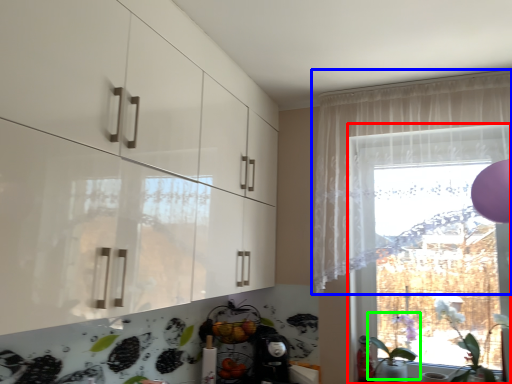
Question: Which object is the closest to the window (highlighted by a red box)? Choose among these: curtain (highlighted by a blue box) or plant (highlighted by a green box).

Choices:
 (A) curtain
 (B) plant

Answer: (A)